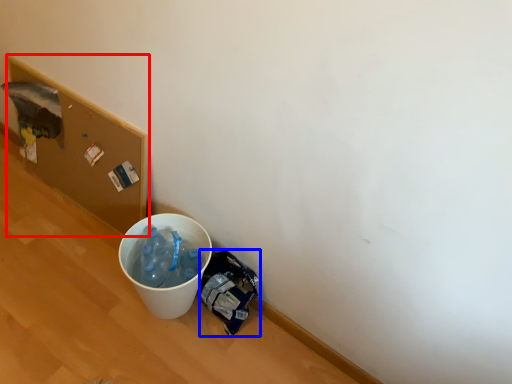
Question: Which object is further to the camera taking this photo, cardboard box (highlighted by a red box) or garbage (highlighted by a blue box)?

Choices:
 (A) cardboard box
 (B) garbage

Answer: (A)